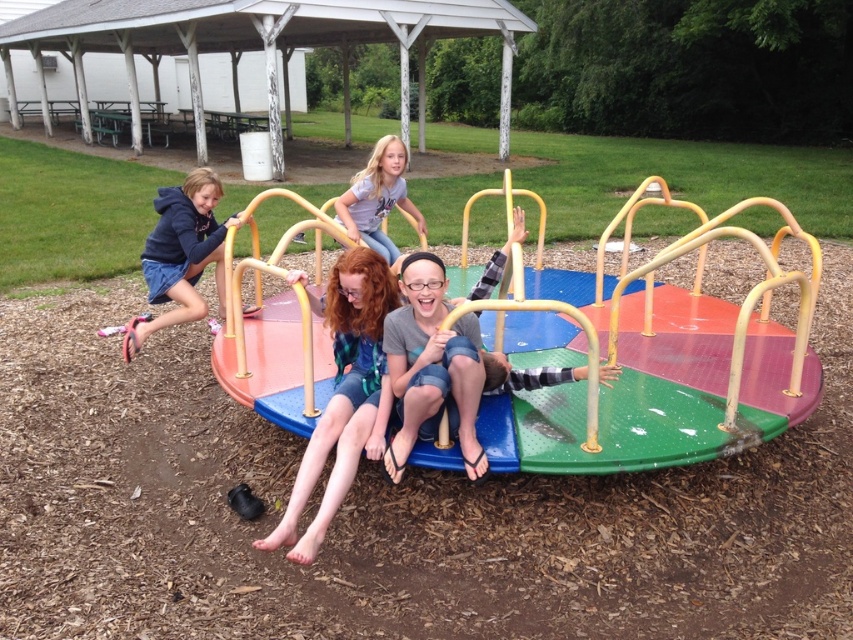
Question: Is matte green dress at center below matte green shorts at center?

Choices:
 (A) yes
 (B) no

Answer: (A)

Question: Which of the following is the farthest from the observer?

Choices:
 (A) matte black hoodie at left
 (B) light gray t-shirt at center

Answer: (B)

Question: Can you confirm if matte green shorts at center is positioned below light gray t-shirt at center?

Choices:
 (A) no
 (B) yes

Answer: (B)

Question: Among these objects, which one is nearest to the camera?

Choices:
 (A) matte green dress at center
 (B) light gray t-shirt at center
 (C) matte green shorts at center
 (D) matte black hoodie at left

Answer: (A)

Question: Among these objects, which one is nearest to the camera?

Choices:
 (A) light gray t-shirt at center
 (B) matte green dress at center

Answer: (B)

Question: Observing the image, what is the correct spatial positioning of matte green shorts at center in reference to matte black hoodie at left?

Choices:
 (A) right
 (B) left

Answer: (A)